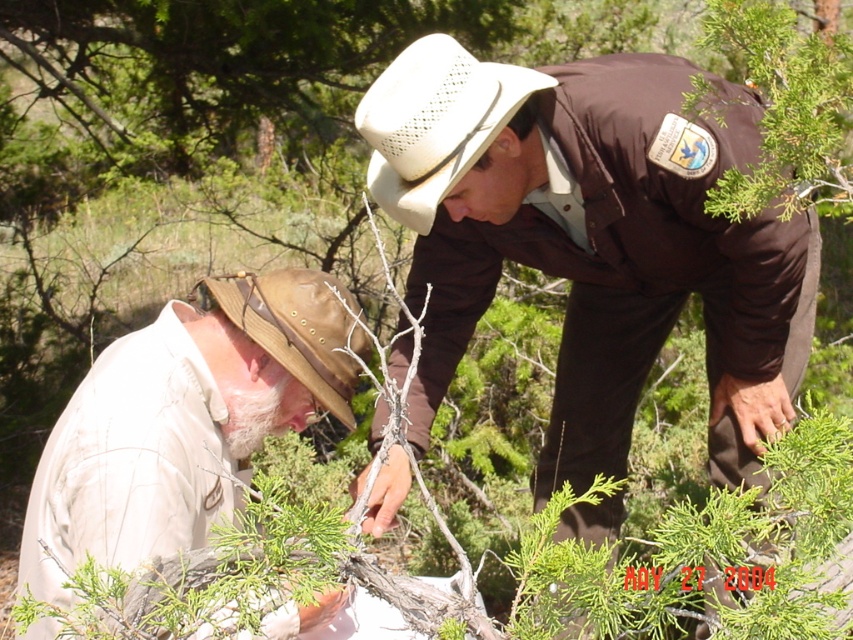
Question: Does white cotton shirt at lower left lie in front of white woven hat at center?

Choices:
 (A) yes
 (B) no

Answer: (A)

Question: Among these objects, which one is nearest to the camera?

Choices:
 (A) white cotton shirt at lower left
 (B) brown leather hat at lower left
 (C) brown uniform at center

Answer: (A)

Question: Among these objects, which one is nearest to the camera?

Choices:
 (A) white cotton shirt at lower left
 (B) brown leather hat at lower left

Answer: (A)

Question: Estimate the real-world distances between objects in this image. Which object is closer to the white woven hat at center?

Choices:
 (A) brown uniform at center
 (B) white cotton shirt at lower left
 (C) brown leather hat at lower left

Answer: (C)

Question: Is white woven hat at center thinner than brown leather hat at lower left?

Choices:
 (A) yes
 (B) no

Answer: (B)

Question: Does brown uniform at center appear on the left side of white cotton shirt at lower left?

Choices:
 (A) yes
 (B) no

Answer: (B)